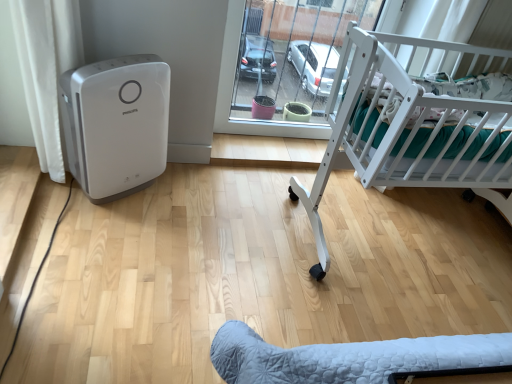
What is the approximate width of white plastic air purifier at left?

white plastic air purifier at left is 9.46 inches wide.

Measure the distance between white matte crib at right and camera.

white matte crib at right and camera are 1.17 meters apart.

In order to face white matte crib at right, should I rotate leftwards or rightwards?

Turn right approximately 26.436 degrees to face it.

At what (x,y) coordinates should I click in order to perform the action: click on white plastic air purifier at left. Please return your answer as a coordinate pair (x, y). The width and height of the screenshot is (512, 384). Looking at the image, I should click on (116, 124).

Can you confirm if white matte crib at right is positioned to the left of transparent glass door at center?

No, white matte crib at right is not to the left of transparent glass door at center.

Is white matte crib at right positioned with its back to transparent glass door at center?

Absolutely, white matte crib at right is directed away from transparent glass door at center.

Is transparent glass door at center surrounded by white matte crib at right?

Definitely not — transparent glass door at center is not inside white matte crib at right.

From a real-world perspective, does white matte crib at right stand above white plastic air purifier at left?

Yes, from a real-world perspective, white matte crib at right is above white plastic air purifier at left.

Is point (353, 142) closer to camera compared to point (89, 190)?

Yes.

From the image's perspective, is white matte crib at right above or below white plastic air purifier at left?

Clearly, from the image's perspective, white matte crib at right is above white plastic air purifier at left.

Is white matte crib at right bigger than white plastic air purifier at left?

Correct, white matte crib at right is larger in size than white plastic air purifier at left.

From the image's perspective, is transparent glass door at center above or below white plastic air purifier at left?

From the image's perspective, transparent glass door at center appears above white plastic air purifier at left.

Considering their positions, is transparent glass door at center located in front of or behind white plastic air purifier at left?

transparent glass door at center is behind white plastic air purifier at left.

Is transparent glass door at center far away from white plastic air purifier at left?

transparent glass door at center is near white plastic air purifier at left, not far away.

From a real-world perspective, between white plastic air purifier at left and transparent glass door at center, who is vertically higher?

transparent glass door at center, from a real-world perspective.

Between white plastic air purifier at left and transparent glass door at center, which one has more height?

With more height is transparent glass door at center.

From a real-world perspective, who is located lower, white plastic air purifier at left or white matte crib at right?

In real-world perspective, white plastic air purifier at left is lower.

Which is in front, point (166, 81) or point (361, 67)?

Point (361, 67)

Considering the positions of objects white plastic air purifier at left and white matte crib at right in the image provided, who is more to the right, white plastic air purifier at left or white matte crib at right?

From the viewer's perspective, white matte crib at right appears more on the right side.

How much distance is there between transparent glass door at center and white matte crib at right?

19.57 inches.

Would you say transparent glass door at center is to the left or to the right of white matte crib at right in the picture?

Based on their positions, transparent glass door at center is located to the left of white matte crib at right.

Based on the photo, is transparent glass door at center next to white matte crib at right and touching it?

No, transparent glass door at center is not making contact with white matte crib at right.

Consider the image. Does transparent glass door at center come in front of white matte crib at right?

No, transparent glass door at center is further to the viewer.

You are a GUI agent. You are given a task and a screenshot of the screen. Output one action in this format:
    pyautogui.click(x=<x>, y=<y>)
    Task: Click on the glass door above the white matte crib at right (from the image's perspective)
    
    Given the screenshot: What is the action you would take?
    pyautogui.click(x=284, y=61)

You are a GUI agent. You are given a task and a screenshot of the screen. Output one action in this format:
    pyautogui.click(x=<x>, y=<y>)
    Task: Click on the home appliance below the white matte crib at right (from the image's perspective)
    
    Given the screenshot: What is the action you would take?
    pyautogui.click(x=116, y=124)

When comparing their distances from transparent glass door at center, does white plastic air purifier at left or white matte crib at right seem closer?

Based on the image, white matte crib at right appears to be nearer to transparent glass door at center.

Considering their positions, is white matte crib at right positioned further to white plastic air purifier at left than transparent glass door at center?

white matte crib at right is positioned further to the anchor white plastic air purifier at left.

Which object lies further to the anchor point white plastic air purifier at left, transparent glass door at center or white matte crib at right?

Among the two, white matte crib at right is located further to white plastic air purifier at left.

From the image, which object appears to be farther from white matte crib at right, white plastic air purifier at left or transparent glass door at center?

Based on the image, white plastic air purifier at left appears to be further to white matte crib at right.

Based on their spatial positions, is white matte crib at right or white plastic air purifier at left further from transparent glass door at center?

Based on the image, white plastic air purifier at left appears to be further to transparent glass door at center.

Based on their spatial positions, is transparent glass door at center or white plastic air purifier at left further from white matte crib at right?

Based on the image, white plastic air purifier at left appears to be further to white matte crib at right.

In order to click on glass door between white plastic air purifier at left and white matte crib at right in this screenshot , I will do `click(284, 61)`.